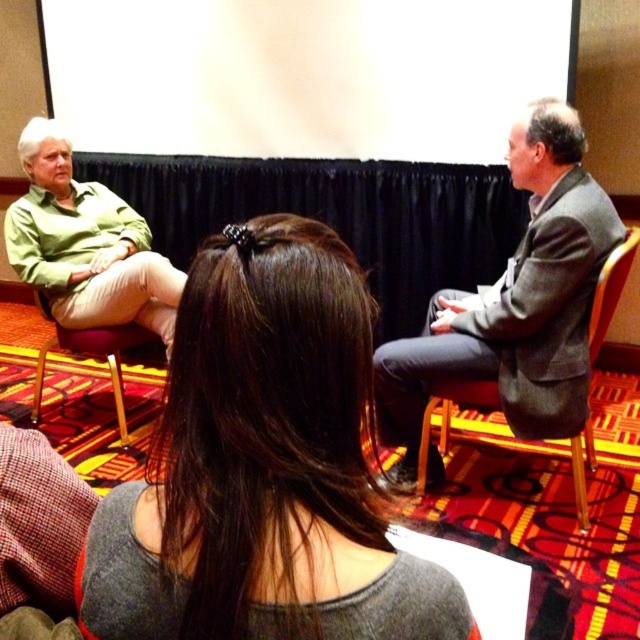
You are attending a conference and need to determine which speaker is taller based on their clothing. Given that you can only see the gray suit at right and the green matte shirt at left, which one is taller?

The gray suit at right is taller than the green matte shirt at left according to the description.

You are a photographer standing at the back of the room. You want to take a photo of the dark brown hair at center and the green matte shirt at left such that both are in focus. The camera you are using has a depth of field that can cover 2 meters. Will both subjects be in focus?

The dark brown hair at center and green matte shirt at left are 2.18 meters apart from each other. Since the camera can only cover 2 meters, the distance between them exceeds the depth of field, so both subjects cannot be in focus simultaneously.